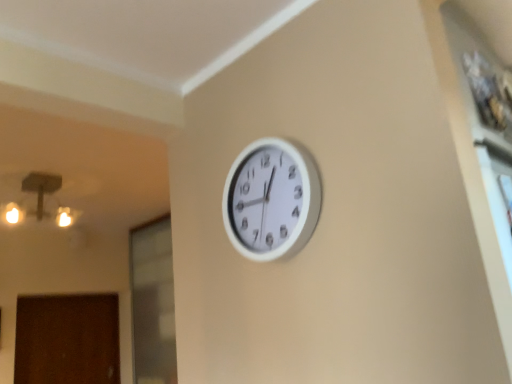
In order to face white plastic clock at upper center, should I rotate leftwards or rightwards?

To face it directly, rotate right by 1.431 degrees.

The width and height of the screenshot is (512, 384). What do you see at coordinates (153, 303) in the screenshot?
I see `transparent glass door at lower left` at bounding box center [153, 303].

Locate an element on the screen. white plastic clock at upper center is located at coordinates (272, 199).

Consider the image. From the image's perspective, is transparent glass door at lower left below white plastic clock at upper center?

Yes.

Are transparent glass door at lower left and white plastic clock at upper center making contact?

No, transparent glass door at lower left is not making contact with white plastic clock at upper center.

Can we say transparent glass door at lower left lies outside white plastic clock at upper center?

Indeed, transparent glass door at lower left is completely outside white plastic clock at upper center.

In the scene shown: Considering the relative sizes of transparent glass door at lower left and white plastic clock at upper center in the image provided, is transparent glass door at lower left smaller than white plastic clock at upper center?

No.

Who is bigger, brown matte door at lower left or transparent glass door at lower left?

transparent glass door at lower left is bigger.

Is brown matte door at lower left not inside transparent glass door at lower left?

Yes, brown matte door at lower left is not within transparent glass door at lower left.

Identify the location of glass door above the brown matte door at lower left (from the image's perspective). (153, 303).

From a real-world perspective, is transparent glass door at lower left physically located above or below brown matte door at lower left?

transparent glass door at lower left is situated higher than brown matte door at lower left in the real world.

Find the location of a particular element. The image size is (512, 384). door behind the transparent glass door at lower left is located at coordinates (67, 339).

Can brown matte door at lower left be found inside transparent glass door at lower left?

No, brown matte door at lower left is not inside transparent glass door at lower left.

Considering the sizes of objects white plastic clock at upper center and transparent glass door at lower left in the image provided, who is taller, white plastic clock at upper center or transparent glass door at lower left?

Standing taller between the two is transparent glass door at lower left.

From the image's perspective, which one is positioned lower, white plastic clock at upper center or transparent glass door at lower left?

transparent glass door at lower left appears lower in the image.

Does white plastic clock at upper center come behind transparent glass door at lower left?

No, white plastic clock at upper center is closer to the viewer.

From a real-world perspective, is brown matte door at lower left on white plastic clock at upper center?

Actually, brown matte door at lower left is physically below white plastic clock at upper center in the real world.

Does brown matte door at lower left have a greater height compared to white plastic clock at upper center?

Yes, brown matte door at lower left is taller than white plastic clock at upper center.

Which of these two, brown matte door at lower left or white plastic clock at upper center, is wider?

With larger width is brown matte door at lower left.

Choose the correct answer: Is white plastic clock at upper center inside brown matte door at lower left or outside it?

white plastic clock at upper center cannot be found inside brown matte door at lower left.

Is white plastic clock at upper center far from brown matte door at lower left?

Indeed, white plastic clock at upper center is not near brown matte door at lower left.

Is the position of white plastic clock at upper center more distant than that of brown matte door at lower left?

No.

Find the location of `wall clock above the transparent glass door at lower left (from a real-world perspective)`. wall clock above the transparent glass door at lower left (from a real-world perspective) is located at coordinates (272, 199).

This screenshot has width=512, height=384. In order to click on glass door in front of the brown matte door at lower left in this screenshot , I will do coord(153,303).

Estimate the real-world distances between objects in this image. Which object is closer to brown matte door at lower left, transparent glass door at lower left or white plastic clock at upper center?

Among the two, transparent glass door at lower left is located nearer to brown matte door at lower left.

Based on their spatial positions, is white plastic clock at upper center or brown matte door at lower left closer to transparent glass door at lower left?

Based on the image, brown matte door at lower left appears to be nearer to transparent glass door at lower left.

Considering their positions, is brown matte door at lower left positioned further to transparent glass door at lower left than white plastic clock at upper center?

white plastic clock at upper center.

Based on their spatial positions, is white plastic clock at upper center or transparent glass door at lower left closer to brown matte door at lower left?

transparent glass door at lower left lies closer to brown matte door at lower left than the other object.

Considering their positions, is transparent glass door at lower left positioned further to white plastic clock at upper center than brown matte door at lower left?

The object further to white plastic clock at upper center is brown matte door at lower left.

Based on the photo, looking at the image, which one is located closer to white plastic clock at upper center, brown matte door at lower left or transparent glass door at lower left?

Based on the image, transparent glass door at lower left appears to be nearer to white plastic clock at upper center.

At what (x,y) coordinates should I click in order to perform the action: click on glass door positioned between white plastic clock at upper center and brown matte door at lower left from near to far. Please return your answer as a coordinate pair (x, y). Looking at the image, I should click on (153, 303).